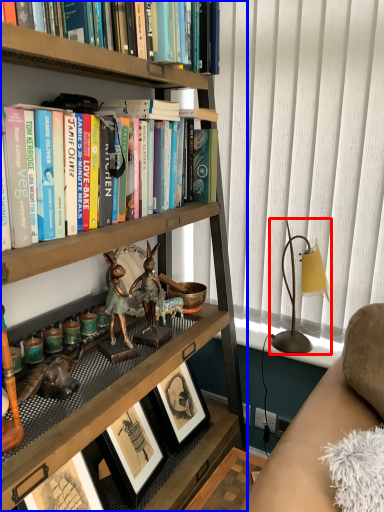
Question: Which object is further to the camera taking this photo, table lamp (highlighted by a red box) or bookcase (highlighted by a blue box)?

Choices:
 (A) table lamp
 (B) bookcase

Answer: (A)